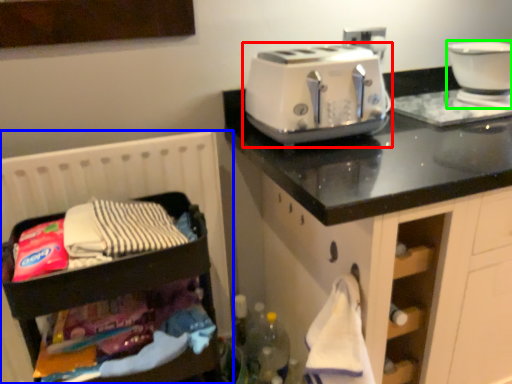
Question: Estimate the real-world distances between objects in this image. Which object is farther from toaster (highlighted by a red box), infant bed (highlighted by a blue box) or home appliance (highlighted by a green box)?

Choices:
 (A) infant bed
 (B) home appliance

Answer: (B)